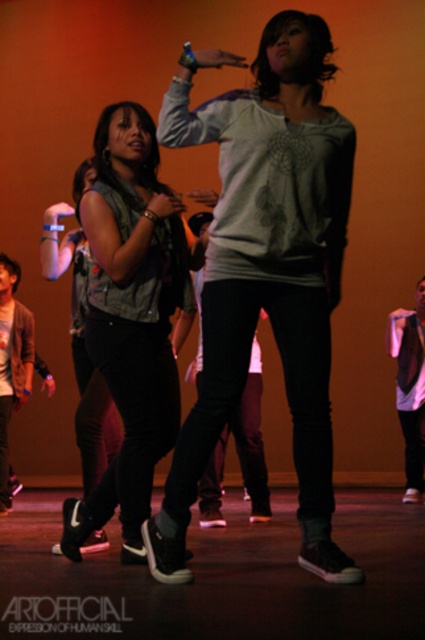
Can you confirm if matte gray sweatshirt at center is taller than denim vest at center?

Yes, matte gray sweatshirt at center is taller than denim vest at center.

Between matte gray sweatshirt at center and denim vest at center, which one appears on the right side from the viewer's perspective?

Positioned to the right is matte gray sweatshirt at center.

Is point (282, 134) less distant than point (150, 188)?

Yes.

This screenshot has width=425, height=640. In order to click on matte gray sweatshirt at center in this screenshot , I will do `click(266, 269)`.

Based on the photo, between matte gray sweatshirt at center and white matte shirt at center, which one has less height?

With less height is white matte shirt at center.

Is matte gray sweatshirt at center wider than white matte shirt at center?

Yes.

Locate an element on the screen. This screenshot has width=425, height=640. matte gray sweatshirt at center is located at coordinates (266, 269).

Find the location of `matte gray sweatshirt at center`. matte gray sweatshirt at center is located at coordinates (266, 269).

Which is more to the right, denim vest at center or white matte shirt at center?

From the viewer's perspective, white matte shirt at center appears more on the right side.

Does denim vest at center appear under white matte shirt at center?

Incorrect, denim vest at center is not positioned below white matte shirt at center.

In order to click on denim vest at center in this screenshot , I will do `click(130, 317)`.

The height and width of the screenshot is (640, 425). Identify the location of denim vest at center. (130, 317).